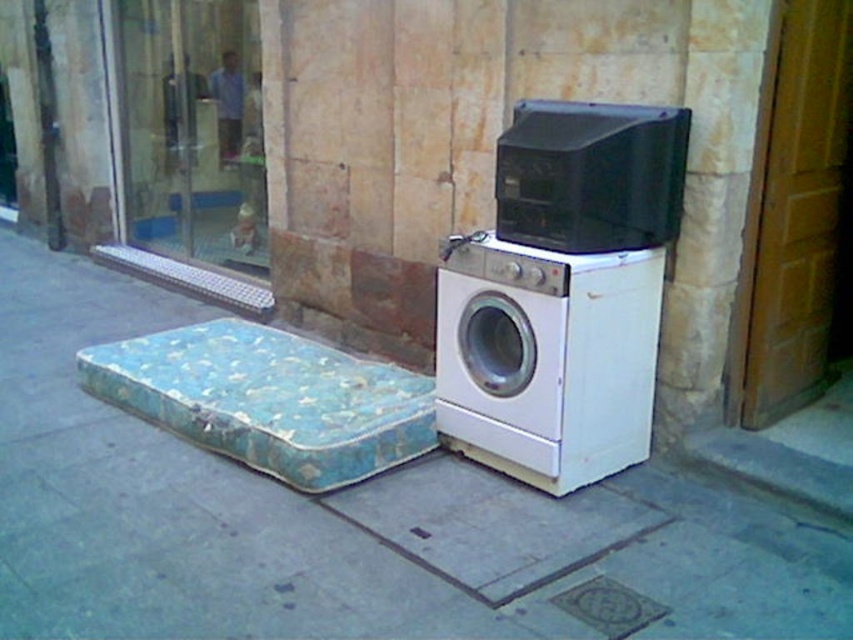
Is gray concrete curb at lower right taller than metallic grid at lower left?

No.

Does gray concrete curb at lower right appear under metallic grid at lower left?

Yes, gray concrete curb at lower right is below metallic grid at lower left.

Is point (741, 465) positioned before point (263, 291)?

Yes, point (741, 465) is in front of point (263, 291).

Image resolution: width=853 pixels, height=640 pixels. I want to click on gray concrete curb at lower right, so click(773, 468).

Who is more forward, (523, 465) or (231, 396)?

Point (523, 465) is in front.

Does point (613, 317) come closer to viewer compared to point (117, 387)?

Yes, point (613, 317) is in front of point (117, 387).

Who is more distant from viewer, (541, 259) or (235, 355)?

Point (235, 355)

Where is `white matte washing machine at lower right`? Image resolution: width=853 pixels, height=640 pixels. white matte washing machine at lower right is located at coordinates (546, 356).

From the picture: Is blue fabric mattress at lower left below black plastic microwave at upper center?

Yes, blue fabric mattress at lower left is below black plastic microwave at upper center.

Is blue fabric mattress at lower left smaller than black plastic microwave at upper center?

Incorrect, blue fabric mattress at lower left is not smaller in size than black plastic microwave at upper center.

Image resolution: width=853 pixels, height=640 pixels. What do you see at coordinates (268, 400) in the screenshot?
I see `blue fabric mattress at lower left` at bounding box center [268, 400].

Where is `blue fabric mattress at lower left`? The image size is (853, 640). blue fabric mattress at lower left is located at coordinates click(x=268, y=400).